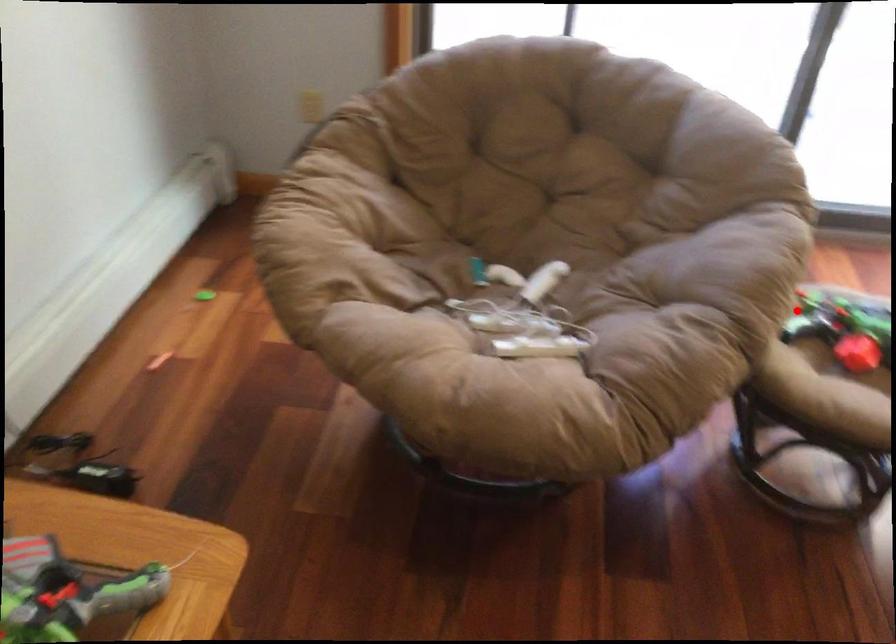
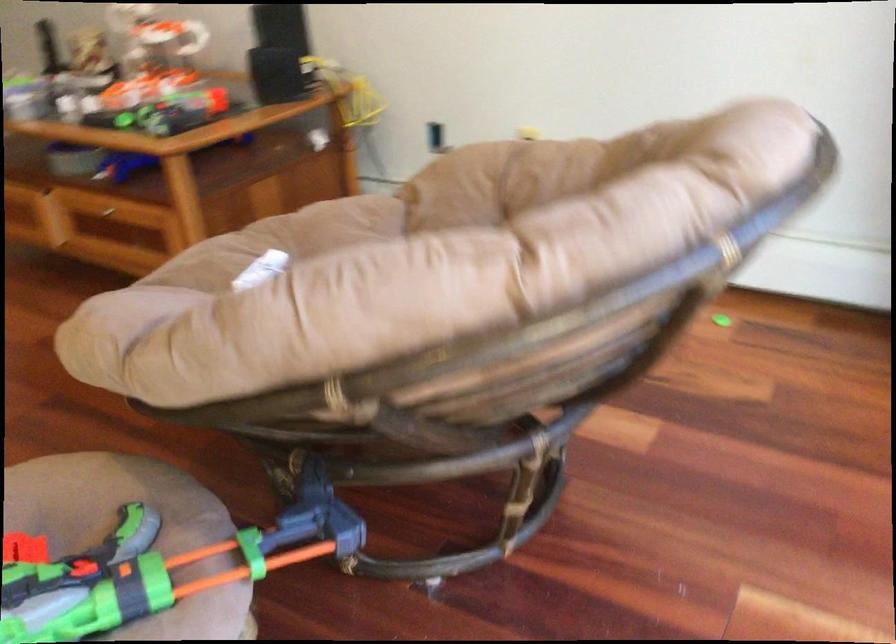
Question: I am providing you with two images of the same scene from different viewpoints. A red point is marked on the first image. Is the red point's position out of view in image 2?

Choices:
 (A) Yes
 (B) No

Answer: (B)